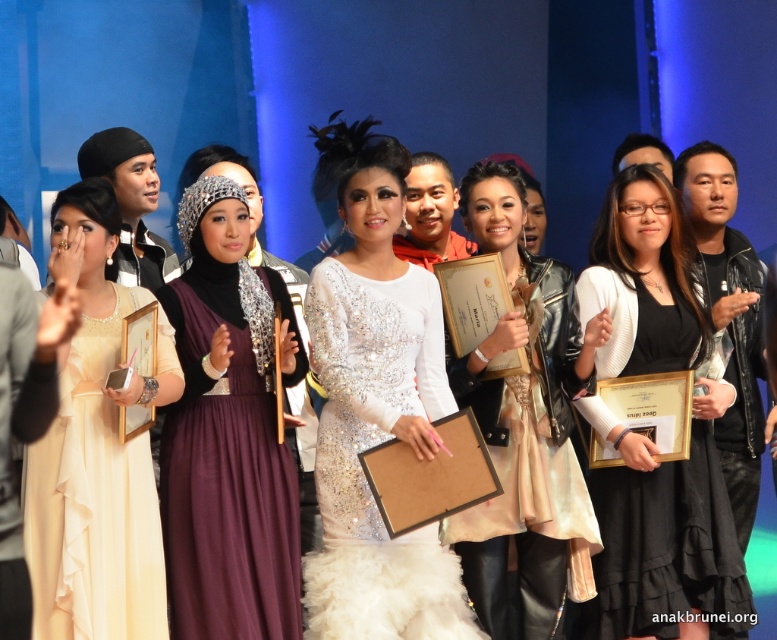
Question: Considering the relative positions of white sequined dress at center and ivory satin dress at left in the image provided, where is white sequined dress at center located with respect to ivory satin dress at left?

Choices:
 (A) right
 (B) left

Answer: (A)

Question: Observing the image, what is the correct spatial positioning of purple satin hijab at center in reference to black matte dress at center?

Choices:
 (A) above
 (B) below

Answer: (A)

Question: Based on their relative distances, which object is farther from the pearl white dress at center?

Choices:
 (A) purple satin hijab at center
 (B) ivory satin dress at left
 (C) white sequined dress at center
 (D) black matte dress at center

Answer: (B)

Question: Is white sequined dress at center below black matte dress at center?

Choices:
 (A) yes
 (B) no

Answer: (B)

Question: Among these objects, which one is farthest from the camera?

Choices:
 (A) purple satin hijab at center
 (B) white sequined dress at center
 (C) black matte dress at center
 (D) pearl white dress at center

Answer: (D)

Question: Which object is farther from the camera taking this photo?

Choices:
 (A) white sequined dress at center
 (B) ivory satin dress at left
 (C) purple satin hijab at center

Answer: (C)